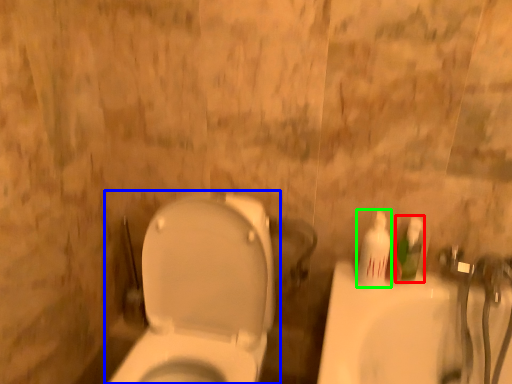
Question: Estimate the real-world distances between objects in this image. Which object is closer to mouthwash (highlighted by a red box), toilet (highlighted by a blue box) or mouthwash (highlighted by a green box)?

Choices:
 (A) toilet
 (B) mouthwash

Answer: (B)